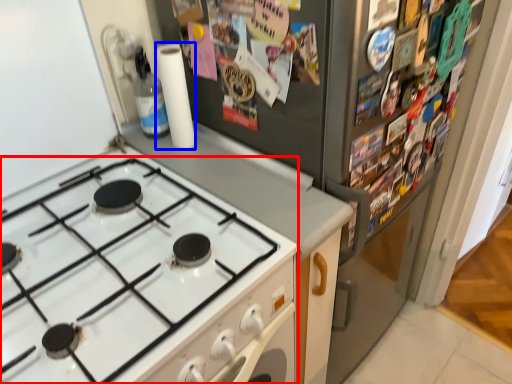
Question: Among these objects, which one is nearest to the camera, gas stove (highlighted by a red box) or paper towel (highlighted by a blue box)?

Choices:
 (A) gas stove
 (B) paper towel

Answer: (A)